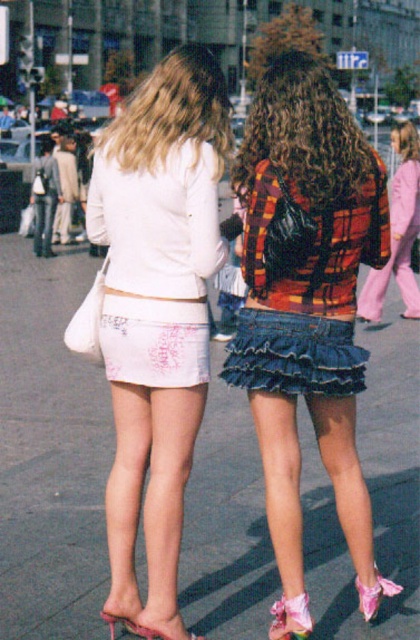
You are a photographer trying to capture a candid shot of the two people in the image. You want to ensure that both the blonde hair at upper center and the denim frill skirt at center are clearly visible in your frame. Based on their positions, which subject should you focus on first to ensure both are in focus?

The blonde hair at upper center is to the left of the denim frill skirt at center, so focusing on the blonde hair at upper center first will help ensure both subjects are in focus as they are aligned horizontally.

You are a photographer trying to capture a clear shot of the denim skirt at center and the pink satin sandal at lower right. Based on their positions, which object is closer to the camera?

The denim skirt at center is positioned over the pink satin sandal at lower right, meaning it is closer to the camera.